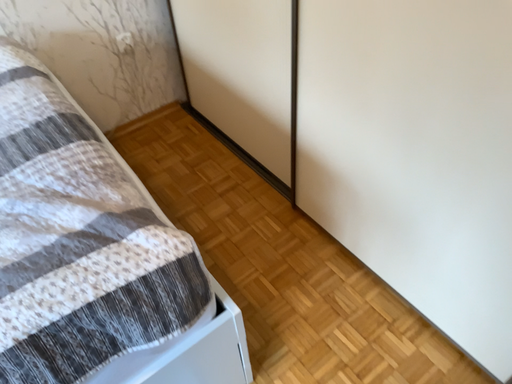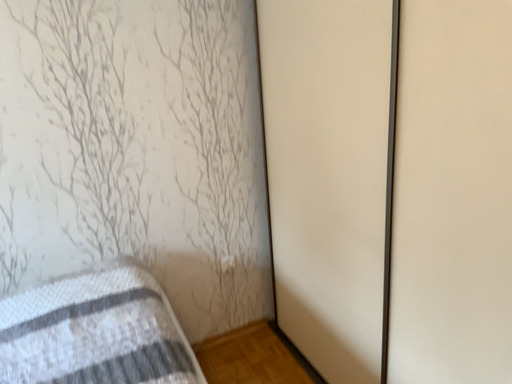
Question: Which way did the camera rotate in the video?

Choices:
 (A) rotated left
 (B) rotated right

Answer: (A)